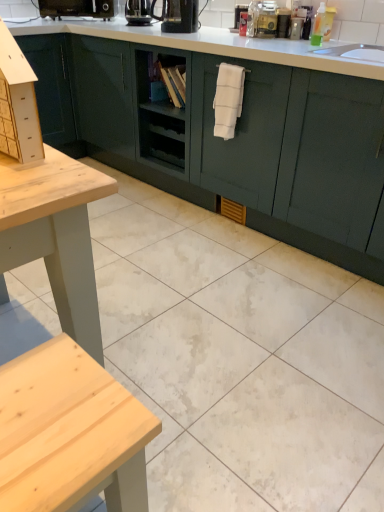
Locate an element on the screen. This screenshot has width=384, height=512. free point in front of translucent plastic bottle at upper right is located at coordinates (343, 47).